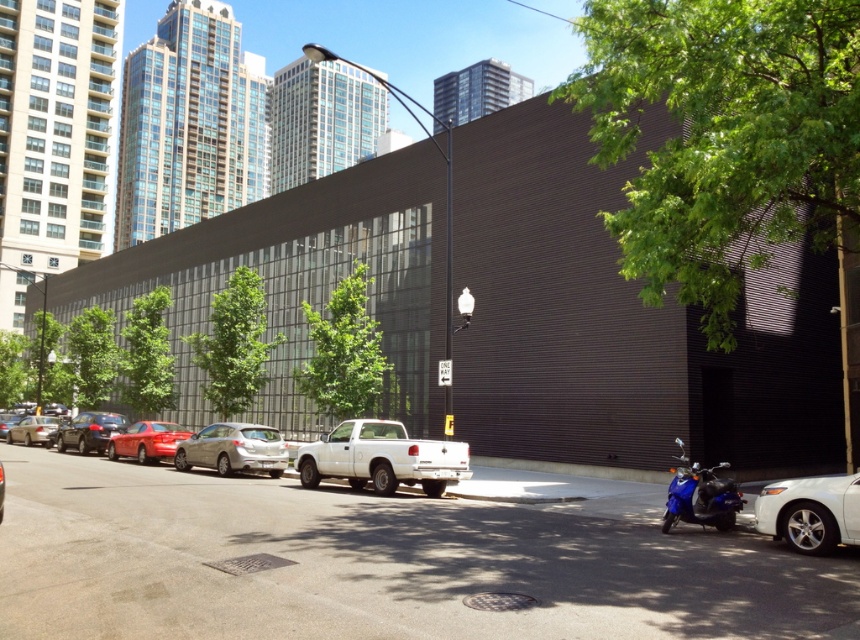
Question: Which of the following is the closest to the observer?

Choices:
 (A) (852, 502)
 (B) (37, 419)
 (C) (222, 448)

Answer: (A)

Question: Does white matte car at lower right appear on the right side of silver metallic sedan at center?

Choices:
 (A) yes
 (B) no

Answer: (A)

Question: Which object is closer to the camera taking this photo?

Choices:
 (A) metallic silver sedan at center
 (B) blue glossy scooter at lower right
 (C) matte silver sedan at left
 (D) shiny red sedan at center

Answer: (A)

Question: Can you confirm if silver metallic sedan at center is wider than matte silver sedan at left?

Choices:
 (A) yes
 (B) no

Answer: (A)

Question: Among these objects, which one is farthest from the camera?

Choices:
 (A) blue glossy scooter at lower right
 (B) silver metallic sedan at center
 (C) shiny red sedan at center
 (D) white matte car at lower right

Answer: (C)

Question: From the image, what is the correct spatial relationship of silver metallic sedan at center in relation to shiny red sedan at center?

Choices:
 (A) left
 (B) right

Answer: (B)